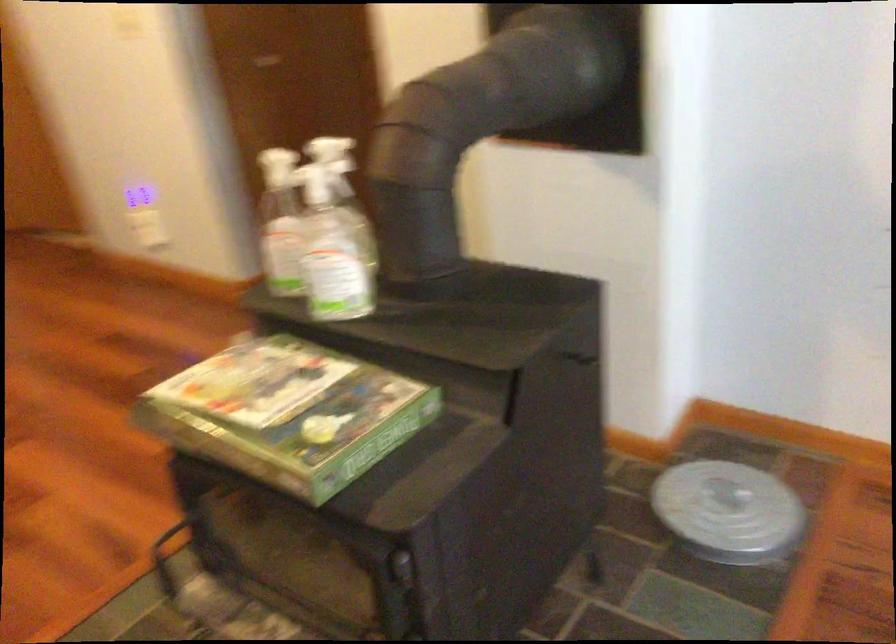
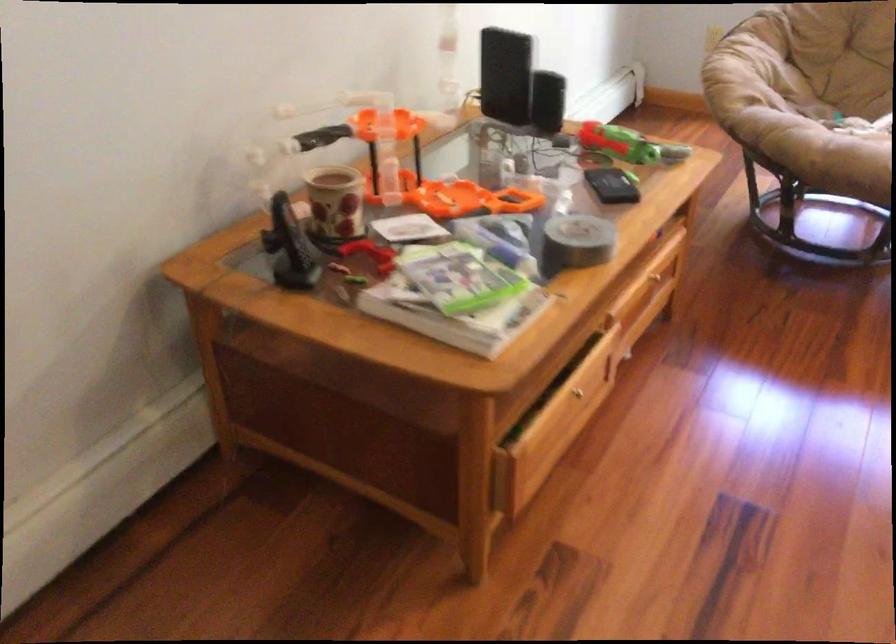
Consider the image. Based on the continuous images, in which direction is the camera rotating?

The rotation direction of the camera is right-down.